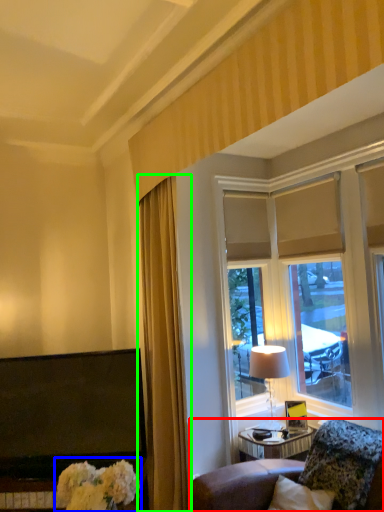
Question: Estimate the real-world distances between objects in this image. Which object is farther from furniture (highlighted by a red box), floral arrangement (highlighted by a blue box) or curtain (highlighted by a green box)?

Choices:
 (A) floral arrangement
 (B) curtain

Answer: (A)